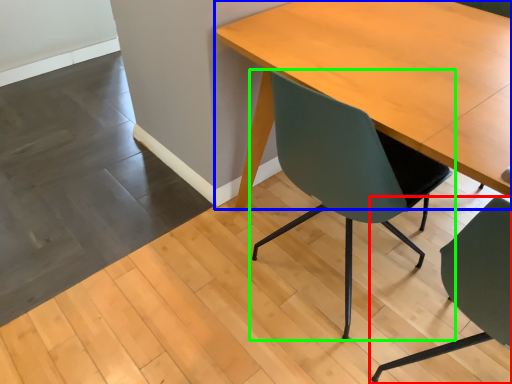
Question: Considering the real-world distances, which object is farthest from chair (highlighted by a red box)? table (highlighted by a blue box) or chair (highlighted by a green box)?

Choices:
 (A) table
 (B) chair

Answer: (A)